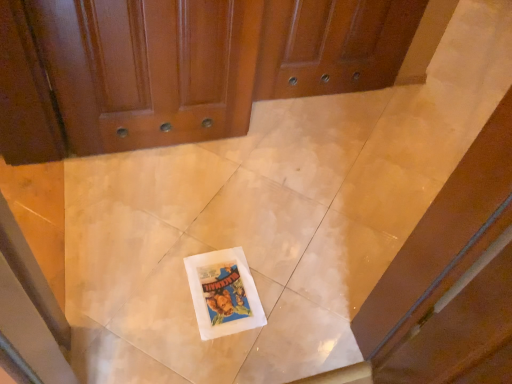
Question: Is point click(122, 61) positioned closer to the camera than point click(245, 283)?

Choices:
 (A) farther
 (B) closer

Answer: (A)

Question: Based on their sizes in the image, would you say glossy wood door at upper center is bigger or smaller than white paper comic book at center?

Choices:
 (A) small
 (B) big

Answer: (B)

Question: Considering the relative positions of glossy wood door at upper center and white paper comic book at center in the image provided, is glossy wood door at upper center to the left or to the right of white paper comic book at center?

Choices:
 (A) right
 (B) left

Answer: (B)

Question: From the image's perspective, is white paper comic book at center located above or below glossy wood door at upper center?

Choices:
 (A) below
 (B) above

Answer: (A)

Question: Is white paper comic book at center inside the boundaries of glossy wood door at upper center, or outside?

Choices:
 (A) outside
 (B) inside

Answer: (A)

Question: Is white paper comic book at center taller or shorter than glossy wood door at upper center?

Choices:
 (A) short
 (B) tall

Answer: (A)

Question: Considering their positions, is white paper comic book at center located in front of or behind glossy wood door at upper center?

Choices:
 (A) behind
 (B) front

Answer: (A)